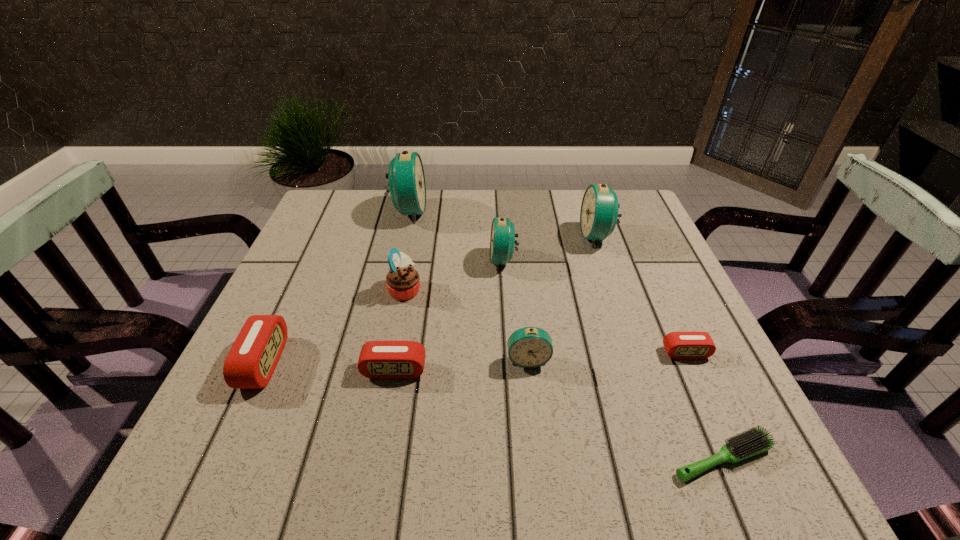
Where is `free space that satisfies the following two spatial constraints: 1. on the front-facing side of the second alarm clock from right to left; 2. on the left side of the light hairbrush`? This screenshot has width=960, height=540. free space that satisfies the following two spatial constraints: 1. on the front-facing side of the second alarm clock from right to left; 2. on the left side of the light hairbrush is located at coordinates (672, 458).